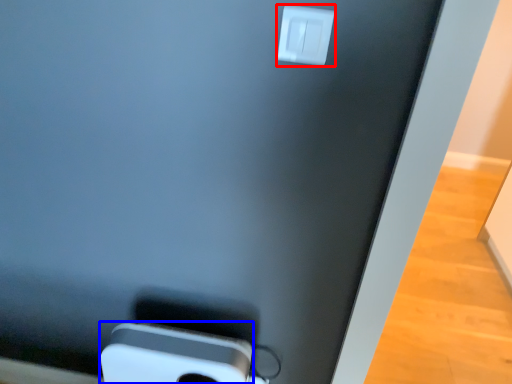
Question: Among these objects, which one is nearest to the camera, power plugs and sockets (highlighted by a red box) or ipod (highlighted by a blue box)?

Choices:
 (A) power plugs and sockets
 (B) ipod

Answer: (A)